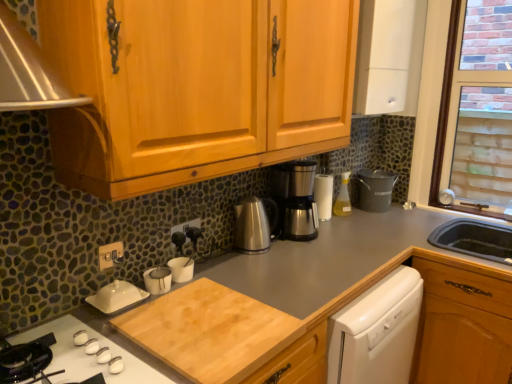
Image resolution: width=512 pixels, height=384 pixels. Identify the location of vacant region in front of satin silver coffee pot at center. (265, 259).